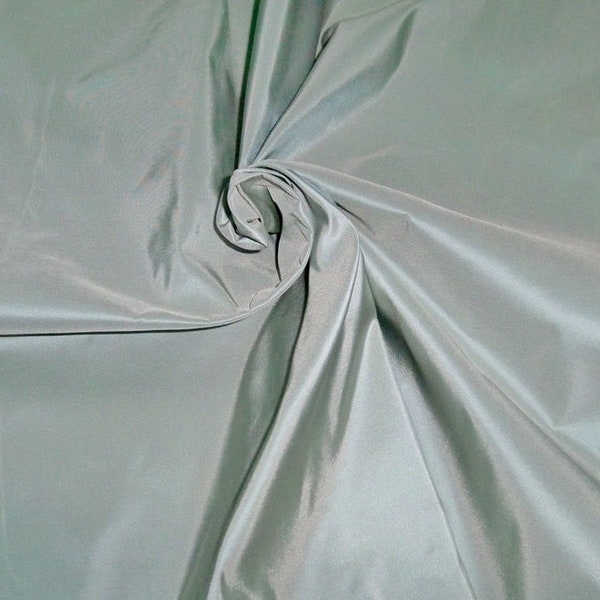
Where is `green silk sheet`? The image size is (600, 600). green silk sheet is located at coordinates pos(220,351).